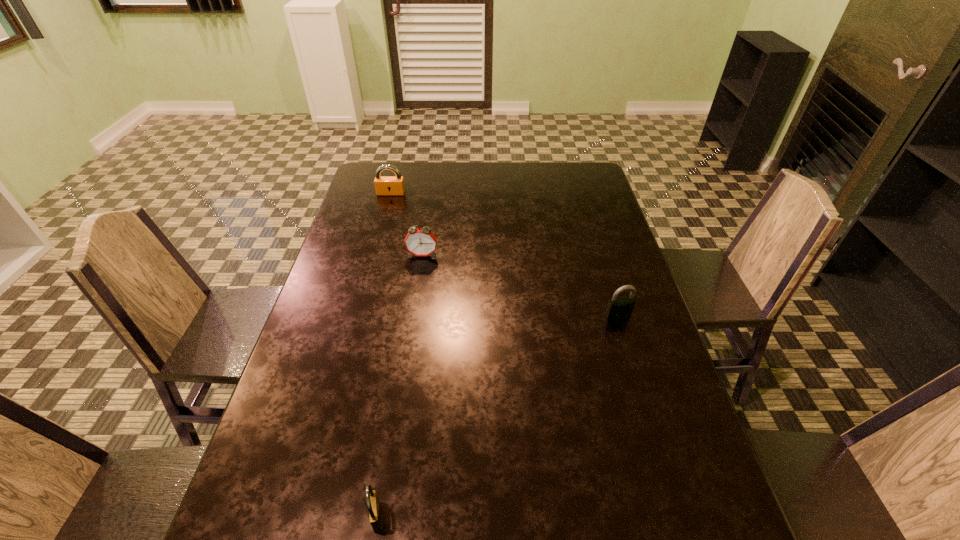
Where is `the farthest object`? the farthest object is located at coordinates (384, 185).

Where is `the leftmost object`? The image size is (960, 540). the leftmost object is located at coordinates (384, 185).

Locate an element on the screen. The height and width of the screenshot is (540, 960). the third nearest object is located at coordinates (420, 242).

Find the location of a particular element. the second nearest object is located at coordinates (619, 308).

The width and height of the screenshot is (960, 540). In order to click on the rightmost object in this screenshot , I will do `click(619, 308)`.

In order to click on the nearest object in this screenshot , I will do `click(374, 510)`.

Image resolution: width=960 pixels, height=540 pixels. In order to click on the nearest padlock in this screenshot , I will do `click(374, 510)`.

Where is `vacant space located to unlock the leftmost padlock from the front`? This screenshot has width=960, height=540. vacant space located to unlock the leftmost padlock from the front is located at coordinates (376, 248).

This screenshot has height=540, width=960. I want to click on free space located on the clock face of the alarm clock, so click(406, 363).

Find the location of `blank space located 0.280m on the left of the second nearest object`. blank space located 0.280m on the left of the second nearest object is located at coordinates (500, 316).